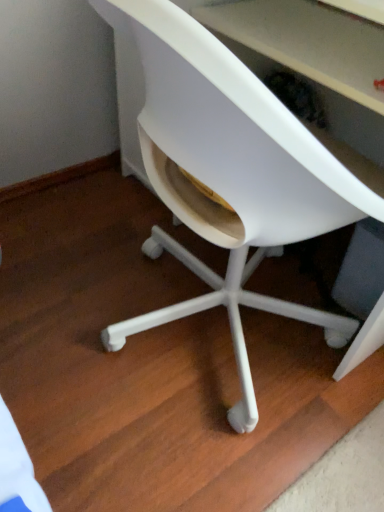
Where is `white plastic chair at center`? The width and height of the screenshot is (384, 512). white plastic chair at center is located at coordinates (233, 175).

Describe the element at coordinates (233, 175) in the screenshot. This screenshot has height=512, width=384. I see `white plastic chair at center` at that location.

Image resolution: width=384 pixels, height=512 pixels. Find the location of `white plastic chair at center`. white plastic chair at center is located at coordinates (233, 175).